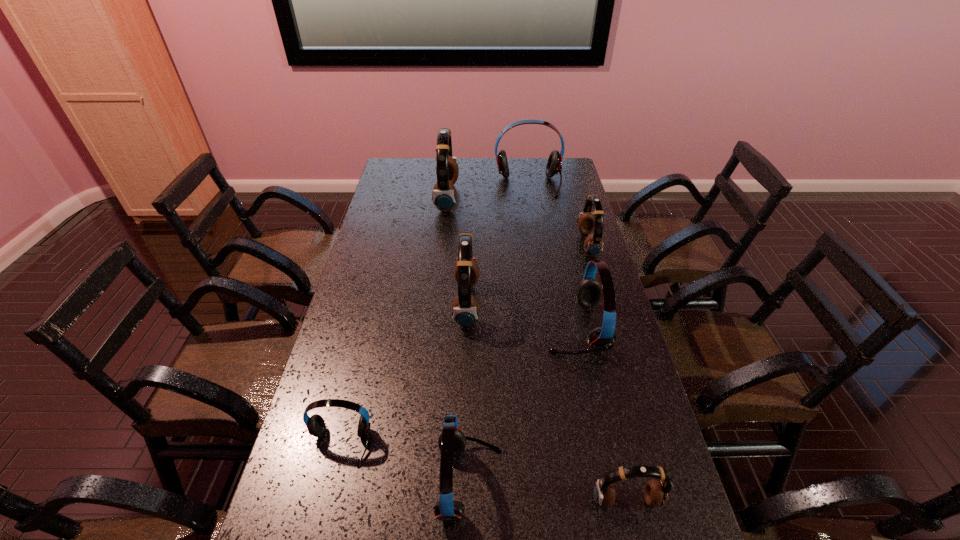
This screenshot has height=540, width=960. What are the coordinates of `vacant region between the third nearest brown headset and the second nearest brown headset` in the screenshot? It's located at (527, 274).

At what (x,y) coordinates should I click in order to perform the action: click on vacant region between the smallest brown headset and the second smallest red headset. Please return your answer as a coordinate pair (x, y). The image size is (960, 540). Looking at the image, I should click on (548, 492).

At what (x,y) coordinates should I click in order to perform the action: click on vacant space that's between the farthest brown headset and the smallest red headset. Please return your answer as a coordinate pair (x, y). The width and height of the screenshot is (960, 540). Looking at the image, I should click on (394, 321).

Locate an element on the screen. free space between the second nearest brown headset and the farthest brown headset is located at coordinates (457, 251).

Where is `empty space that is in between the farthest brown headset and the third smallest brown headset`? The image size is (960, 540). empty space that is in between the farthest brown headset and the third smallest brown headset is located at coordinates (457, 251).

This screenshot has width=960, height=540. Identify the location of vacant area that lies between the leftmost brown headset and the nearest brown headset. (537, 349).

Locate an element on the screen. The image size is (960, 540). empty location between the second brown headset from left to right and the third biggest red headset is located at coordinates 468,394.

Where is `vacant area that lies between the third smallest red headset and the second nearest brown headset`? The image size is (960, 540). vacant area that lies between the third smallest red headset and the second nearest brown headset is located at coordinates (520, 316).

Locate an element on the screen. This screenshot has height=540, width=960. vacant point located between the sixth nearest object and the leftmost brown headset is located at coordinates (517, 221).

Where is `vacant area between the leftmost object and the leftmost brown headset`? Image resolution: width=960 pixels, height=540 pixels. vacant area between the leftmost object and the leftmost brown headset is located at coordinates (394, 321).